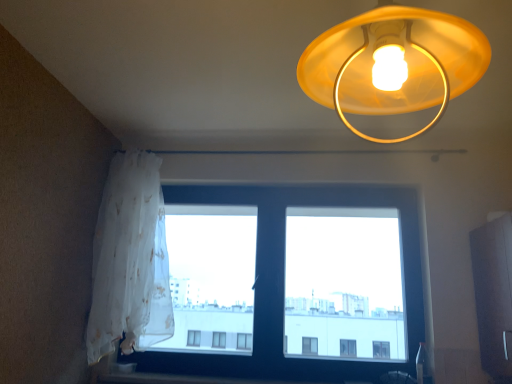
Question: From the image's perspective, is transparent fabric at lower left located above translucent yellow plastic lampshade at upper center?

Choices:
 (A) no
 (B) yes

Answer: (A)

Question: Are transparent fabric at lower left and translucent yellow plastic lampshade at upper center beside each other?

Choices:
 (A) no
 (B) yes

Answer: (A)

Question: From a real-world perspective, does transparent fabric at lower left stand above translucent yellow plastic lampshade at upper center?

Choices:
 (A) no
 (B) yes

Answer: (A)

Question: Is transparent fabric at lower left thinner than translucent yellow plastic lampshade at upper center?

Choices:
 (A) no
 (B) yes

Answer: (B)

Question: Is translucent yellow plastic lampshade at upper center completely or partially inside transparent fabric at lower left?

Choices:
 (A) yes
 (B) no

Answer: (B)

Question: In terms of width, does transparent fabric at lower left look wider or thinner when compared to white sheer curtain at left?

Choices:
 (A) thin
 (B) wide

Answer: (A)

Question: Relative to white sheer curtain at left, is transparent fabric at lower left in front or behind?

Choices:
 (A) behind
 (B) front

Answer: (A)

Question: Looking at the image, does transparent fabric at lower left seem bigger or smaller compared to white sheer curtain at left?

Choices:
 (A) small
 (B) big

Answer: (B)

Question: Would you say transparent fabric at lower left is inside or outside white sheer curtain at left?

Choices:
 (A) outside
 (B) inside

Answer: (A)

Question: In terms of width, does translucent yellow plastic lampshade at upper center look wider or thinner when compared to smooth wood window sill at lower center?

Choices:
 (A) wide
 (B) thin

Answer: (A)

Question: Based on their positions, is translucent yellow plastic lampshade at upper center located to the left or right of smooth wood window sill at lower center?

Choices:
 (A) left
 (B) right

Answer: (B)

Question: From a real-world perspective, is translucent yellow plastic lampshade at upper center positioned above or below smooth wood window sill at lower center?

Choices:
 (A) below
 (B) above

Answer: (B)

Question: Does point (350, 84) appear closer or farther from the camera than point (96, 377)?

Choices:
 (A) farther
 (B) closer

Answer: (B)

Question: Is point (245, 380) positioned closer to the camera than point (146, 306)?

Choices:
 (A) closer
 (B) farther

Answer: (B)

Question: From a real-world perspective, is smooth wood window sill at lower center physically located above or below white sheer curtain at left?

Choices:
 (A) below
 (B) above

Answer: (A)